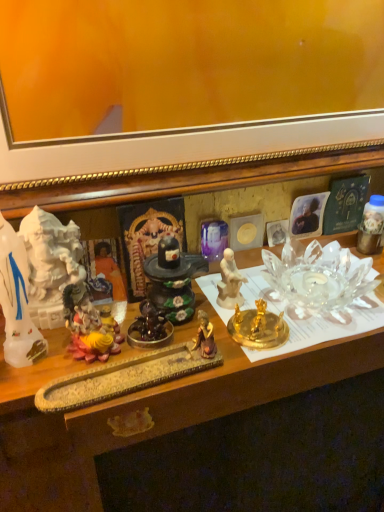
Locate an element on the screen. free spot to the right of orange fabric at center, which is the 2th person in right-to-left order is located at coordinates (228, 313).